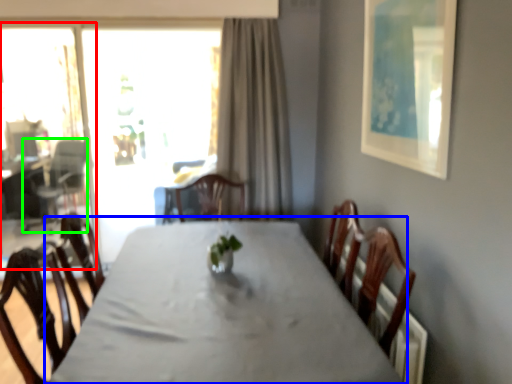
Question: Estimate the real-world distances between objects in this image. Which object is farther from screen door (highlighted by a red box), table (highlighted by a blue box) or armchair (highlighted by a green box)?

Choices:
 (A) table
 (B) armchair

Answer: (A)